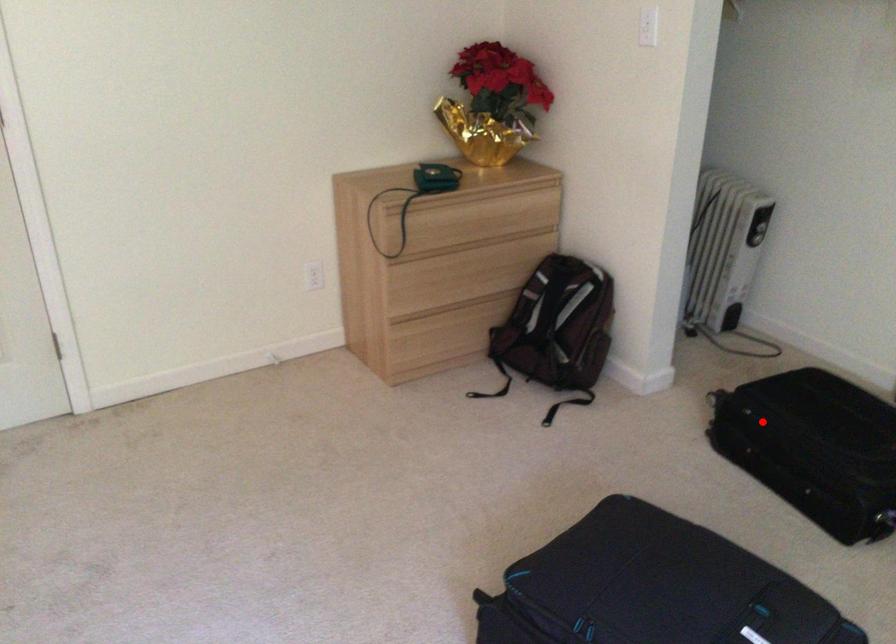
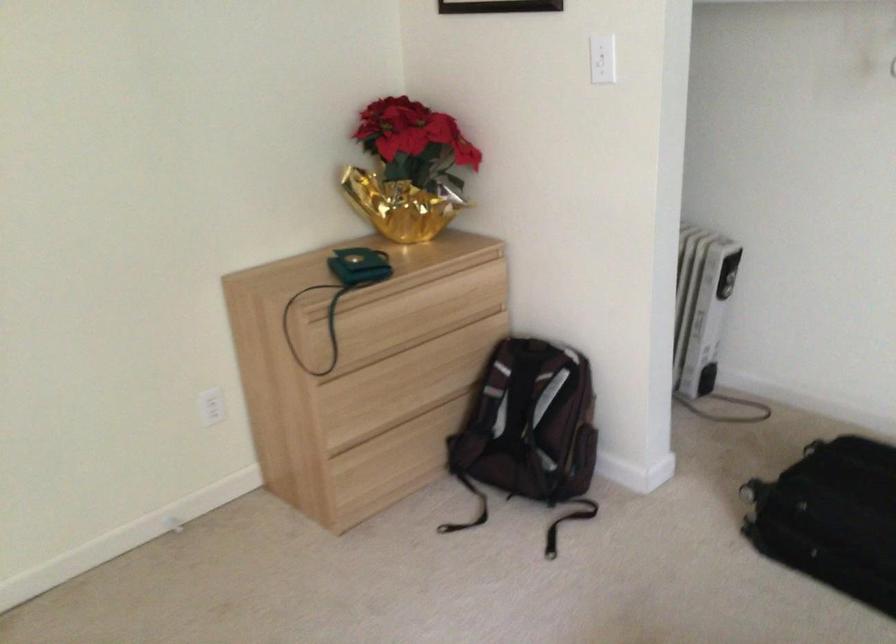
Find the pixel in the second image that matches the highlighted location in the first image.

(831, 518)